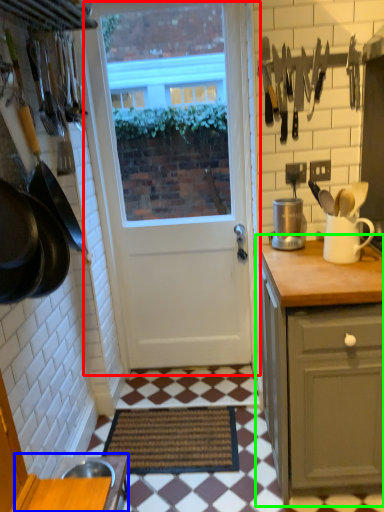
Question: Which object is positioned closest to door (highlighted by a red box)? Select from table (highlighted by a blue box) and cabinetry (highlighted by a green box).

Choices:
 (A) table
 (B) cabinetry

Answer: (B)